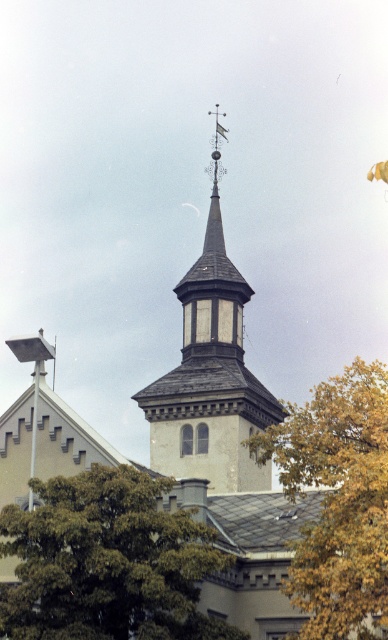
Question: Which is nearer to the smooth gray steeple at center?

Choices:
 (A) yellow leafy tree at upper right
 (B) green leafy tree at lower left

Answer: (A)

Question: Which of the following is the closest to the observer?

Choices:
 (A) (237, 296)
 (B) (372, 506)
 (C) (190, 616)

Answer: (B)

Question: Does green leafy tree at lower left have a smaller size compared to yellow leafy tree at upper right?

Choices:
 (A) yes
 (B) no

Answer: (A)

Question: Is yellow leafy tree at upper right above smooth gray steeple at center?

Choices:
 (A) no
 (B) yes

Answer: (A)

Question: Does yellow leafy tree at upper right have a greater width compared to smooth gray steeple at center?

Choices:
 (A) yes
 (B) no

Answer: (A)

Question: Based on their relative distances, which object is nearer to the yellow leafy tree at upper right?

Choices:
 (A) green leafy tree at lower left
 (B) smooth gray steeple at center

Answer: (A)